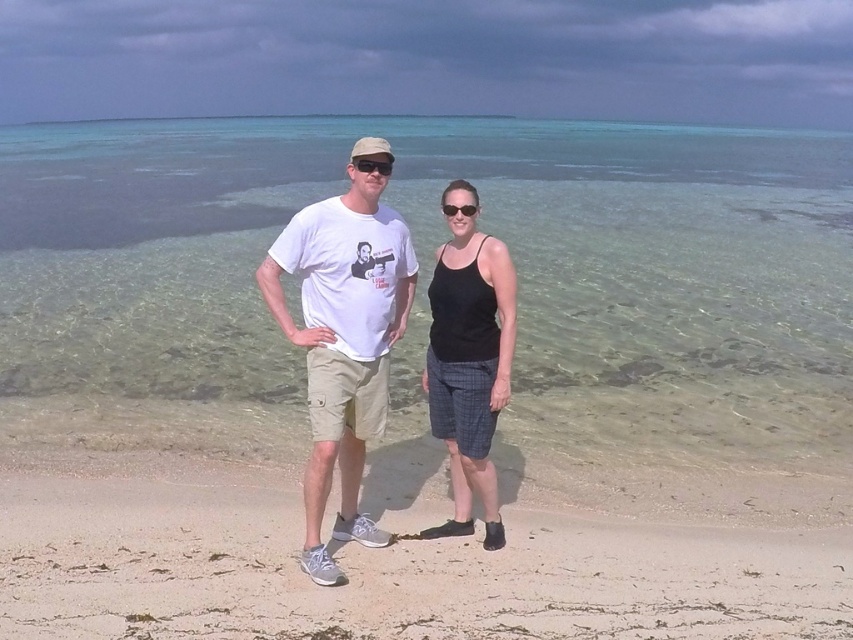
Question: Which point appears farthest from the camera in this image?

Choices:
 (A) (367, 168)
 (B) (425, 531)

Answer: (B)

Question: Observing the image, what is the correct spatial positioning of light beige sand at center in reference to black plastic sunglasses at center?

Choices:
 (A) above
 (B) below

Answer: (B)

Question: Which object is positioned closest to the black woven shorts at center?

Choices:
 (A) black plastic sunglasses at center
 (B) white cotton t-shirt at center

Answer: (B)

Question: Can you confirm if black woven shorts at center is positioned to the left of black matte sunglasses at center?

Choices:
 (A) no
 (B) yes

Answer: (A)

Question: Does light beige sand at center appear under black plastic sunglasses at center?

Choices:
 (A) yes
 (B) no

Answer: (A)

Question: Among these objects, which one is farthest from the camera?

Choices:
 (A) black woven shorts at center
 (B) light beige sand at center
 (C) white cotton t-shirt at center
 (D) black matte sunglasses at center

Answer: (A)